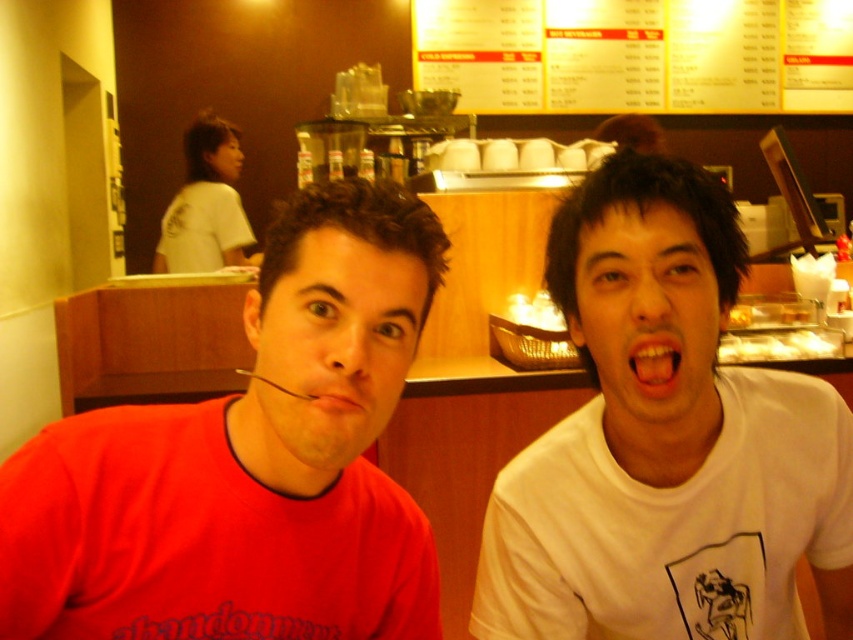
Is the position of matte red shirt at center less distant than that of pink matte lips at center?

That is True.

Is point (410, 275) positioned behind point (344, 403)?

Yes.

Is point (236, 602) in front of point (312, 392)?

No, (236, 602) is behind (312, 392).

Where is `matte red shirt at center`? matte red shirt at center is located at coordinates (247, 464).

Is white matte shirt at right above pink matte lips at center?

No, white matte shirt at right is not above pink matte lips at center.

Is white matte shirt at right thinner than pink matte lips at center?

No, white matte shirt at right is not thinner than pink matte lips at center.

Between point (698, 444) and point (332, 394), which one is positioned in front?

Point (332, 394) is in front.

Locate an element on the screen. The height and width of the screenshot is (640, 853). white matte shirt at right is located at coordinates (666, 444).

Measure the distance between point (236, 472) and camera.

A distance of 24.96 inches exists between point (236, 472) and camera.

Is matte red shirt at center to the right of white matte shirt at right from the viewer's perspective?

In fact, matte red shirt at center is to the left of white matte shirt at right.

Where is `matte red shirt at center`? Image resolution: width=853 pixels, height=640 pixels. matte red shirt at center is located at coordinates (247, 464).